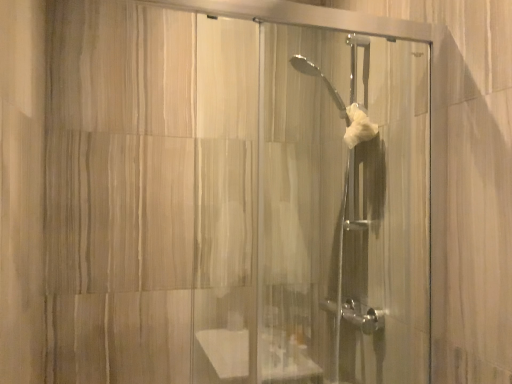
Question: Is white fluffy hand towel at center at the left side of clear glass shower door at center?

Choices:
 (A) no
 (B) yes

Answer: (A)

Question: Considering the relative sizes of white fluffy hand towel at center and clear glass shower door at center in the image provided, is white fluffy hand towel at center shorter than clear glass shower door at center?

Choices:
 (A) no
 (B) yes

Answer: (B)

Question: From the image's perspective, would you say white fluffy hand towel at center is shown under clear glass shower door at center?

Choices:
 (A) yes
 (B) no

Answer: (B)

Question: Can you confirm if white fluffy hand towel at center is wider than clear glass shower door at center?

Choices:
 (A) no
 (B) yes

Answer: (A)

Question: Can you confirm if white fluffy hand towel at center is positioned to the right of clear glass shower door at center?

Choices:
 (A) no
 (B) yes

Answer: (B)

Question: From the image's perspective, would you say white fluffy hand towel at center is positioned over clear glass shower door at center?

Choices:
 (A) yes
 (B) no

Answer: (A)

Question: Is clear glass shower door at center further to the viewer compared to white fluffy hand towel at center?

Choices:
 (A) no
 (B) yes

Answer: (A)

Question: Can you confirm if clear glass shower door at center is positioned to the right of white fluffy hand towel at center?

Choices:
 (A) no
 (B) yes

Answer: (A)

Question: Is the depth of clear glass shower door at center less than that of white fluffy hand towel at center?

Choices:
 (A) no
 (B) yes

Answer: (B)

Question: Is clear glass shower door at center turned away from white fluffy hand towel at center?

Choices:
 (A) no
 (B) yes

Answer: (B)

Question: Does clear glass shower door at center have a lesser height compared to white fluffy hand towel at center?

Choices:
 (A) yes
 (B) no

Answer: (B)

Question: Is clear glass shower door at center far away from white fluffy hand towel at center?

Choices:
 (A) no
 (B) yes

Answer: (A)

Question: Is white fluffy hand towel at center taller or shorter than clear glass shower door at center?

Choices:
 (A) tall
 (B) short

Answer: (B)